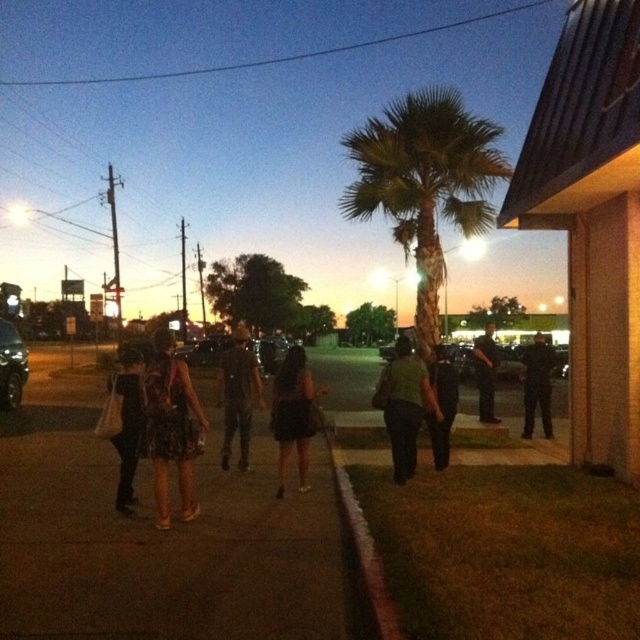
Does dark asphalt sidewalk at center have a lesser height compared to concrete at lower center?

Yes.

Does dark asphalt sidewalk at center have a smaller size compared to concrete at lower center?

Incorrect, dark asphalt sidewalk at center is not smaller in size than concrete at lower center.

Is point (156, 548) positioned in front of point (358, 518)?

That is True.

Find the location of a particular element. dark asphalt sidewalk at center is located at coordinates (156, 536).

Can you confirm if green matte dress at center is positioned above shiny silver car at left?

Incorrect, green matte dress at center is not positioned above shiny silver car at left.

Locate an element on the screen. The height and width of the screenshot is (640, 640). green matte dress at center is located at coordinates (404, 404).

Is green leafy palm tree at center below black matte pants at center-right?

No.

Between green leafy palm tree at center and black matte pants at center-right, which one is positioned higher?

green leafy palm tree at center

You are a GUI agent. You are given a task and a screenshot of the screen. Output one action in this format:
    pyautogui.click(x=<x>, y=<y>)
    Task: Click on the green leafy palm tree at center
    The image size is (640, 640).
    Given the screenshot: What is the action you would take?
    pyautogui.click(x=424, y=182)

The height and width of the screenshot is (640, 640). I want to click on green leafy palm tree at center, so click(424, 182).